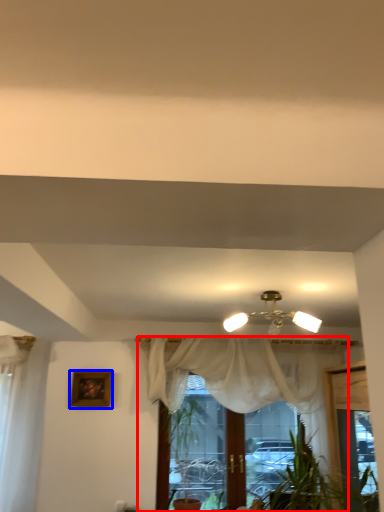
Question: Which object appears farthest to the camera in this image, curtain (highlighted by a red box) or picture frame (highlighted by a blue box)?

Choices:
 (A) curtain
 (B) picture frame

Answer: (B)